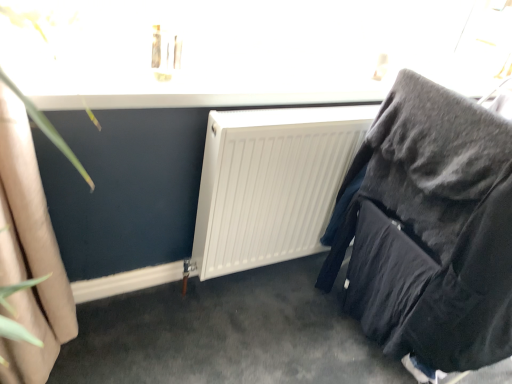
Question: Considering the relative sizes of white plastic radiator at center and velvet black chair at right in the image provided, is white plastic radiator at center wider than velvet black chair at right?

Choices:
 (A) no
 (B) yes

Answer: (A)

Question: Can you confirm if white plastic radiator at center is shorter than velvet black chair at right?

Choices:
 (A) yes
 (B) no

Answer: (A)

Question: Is velvet black chair at right completely or partially inside white plastic radiator at center?

Choices:
 (A) yes
 (B) no

Answer: (B)

Question: Does white plastic radiator at center have a larger size compared to velvet black chair at right?

Choices:
 (A) no
 (B) yes

Answer: (A)

Question: From a real-world perspective, does white plastic radiator at center stand above velvet black chair at right?

Choices:
 (A) no
 (B) yes

Answer: (A)

Question: Does white plastic radiator at center have a lesser width compared to velvet black chair at right?

Choices:
 (A) no
 (B) yes

Answer: (B)

Question: Can you confirm if velvet black chair at right is shorter than white plastic radiator at center?

Choices:
 (A) no
 (B) yes

Answer: (A)

Question: Does velvet black chair at right turn towards white plastic radiator at center?

Choices:
 (A) yes
 (B) no

Answer: (A)

Question: Is velvet black chair at right to the right of white plastic radiator at center from the viewer's perspective?

Choices:
 (A) no
 (B) yes

Answer: (B)

Question: Is velvet black chair at right smaller than white plastic radiator at center?

Choices:
 (A) yes
 (B) no

Answer: (B)

Question: From the image's perspective, is velvet black chair at right under white plastic radiator at center?

Choices:
 (A) no
 (B) yes

Answer: (B)

Question: Is velvet black chair at right thinner than white plastic radiator at center?

Choices:
 (A) no
 (B) yes

Answer: (A)

Question: In the image, is velvet black chair at right positioned in front of or behind white plastic radiator at center?

Choices:
 (A) behind
 (B) front

Answer: (B)